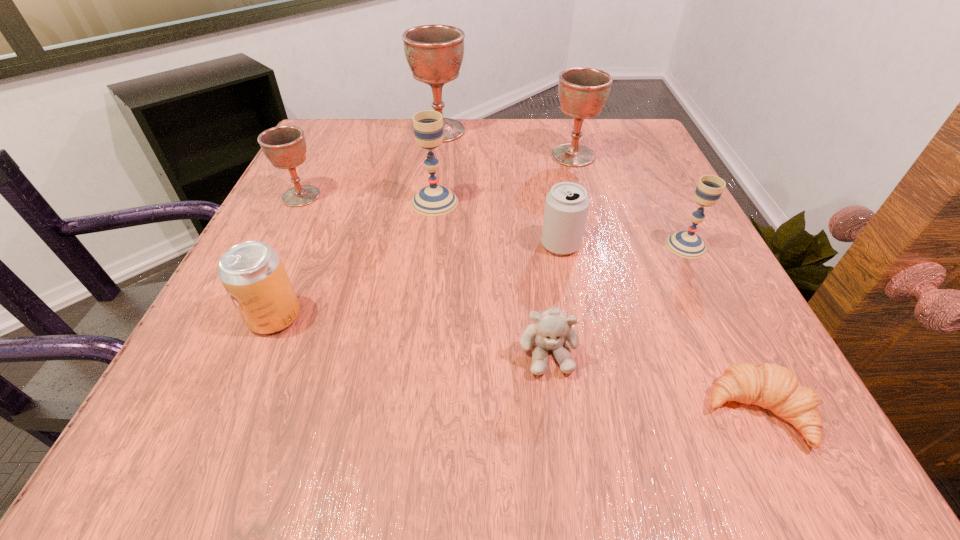
In order to click on pop (soda) in this screenshot , I will do `click(252, 272)`.

Where is `can`? The width and height of the screenshot is (960, 540). can is located at coordinates (566, 207).

At what (x,y) coordinates should I click in order to perform the action: click on the eighth tallest object. Please return your answer as a coordinate pair (x, y). The height and width of the screenshot is (540, 960). Looking at the image, I should click on (551, 327).

Find the location of a particular element. The width and height of the screenshot is (960, 540). gray teddy bear is located at coordinates (551, 327).

Locate an element on the screen. The height and width of the screenshot is (540, 960). the shortest object is located at coordinates (768, 385).

This screenshot has height=540, width=960. In order to click on vacant space located on the left of the tallest object in this screenshot , I will do `click(352, 131)`.

Where is `free region located on the front of the second smallest brown chalice`? This screenshot has height=540, width=960. free region located on the front of the second smallest brown chalice is located at coordinates pos(591,218).

Image resolution: width=960 pixels, height=540 pixels. In order to click on free region located on the left of the farther gray chalice in this screenshot , I will do `click(332, 202)`.

Identify the location of vacant point located 0.130m on the front of the leftmost chalice. This screenshot has width=960, height=540. point(274,252).

Image resolution: width=960 pixels, height=540 pixels. I want to click on vacant space located on the front of the rightmost chalice, so click(x=777, y=426).